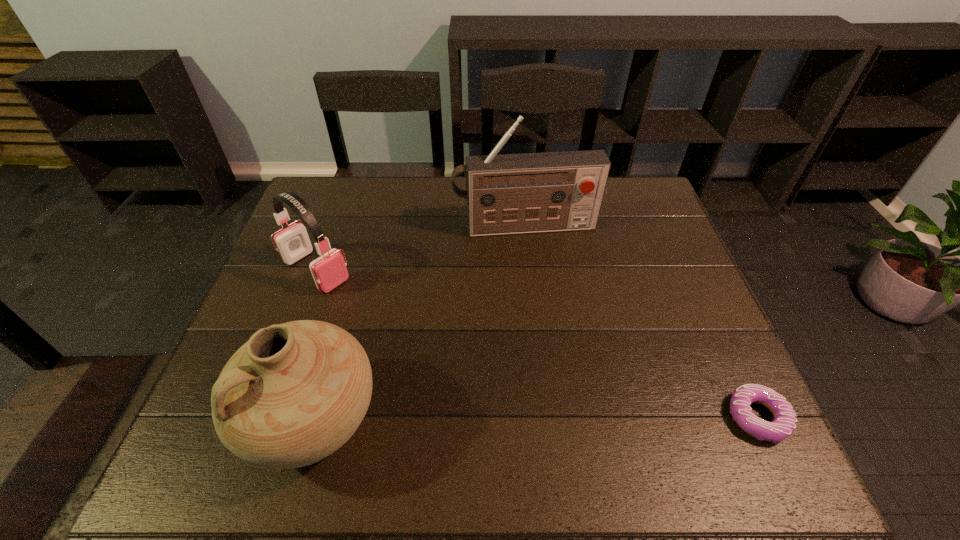
The height and width of the screenshot is (540, 960). Find the location of `pottery`. pottery is located at coordinates (296, 392).

Locate an element on the screen. The image size is (960, 540). doughnut is located at coordinates (784, 423).

You are a GUI agent. You are given a task and a screenshot of the screen. Output one action in this format:
    pyautogui.click(x=<x>, y=<y>)
    Task: Click on the shortest object
    
    Given the screenshot: What is the action you would take?
    pyautogui.click(x=784, y=423)

Locate an element on the screen. The width and height of the screenshot is (960, 540). the third nearest object is located at coordinates (329, 270).

The image size is (960, 540). Identify the location of radio receiver. (506, 194).

Find the location of a particular element. the tallest object is located at coordinates (506, 194).

The image size is (960, 540). In order to click on vacant space situated 0.060m on the left of the pottery in this screenshot , I will do `click(216, 420)`.

Locate an element on the screen. The width and height of the screenshot is (960, 540). blank area located 0.220m on the back of the rightmost object is located at coordinates (708, 312).

The height and width of the screenshot is (540, 960). I want to click on free point located on the outer surface of the second farthest object, so click(x=452, y=374).

What are the coordinates of `vacant space located 0.220m on the outer surface of the second farthest object` in the screenshot? It's located at (396, 331).